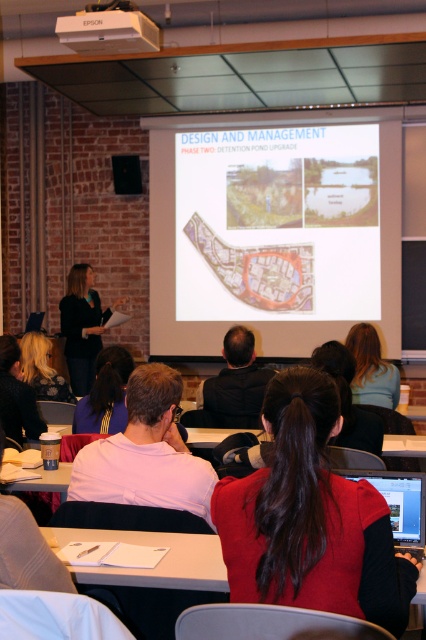
You are sitting in the classroom and want to pass a note to the person with blonde hair at upper center and the person with blonde hair at lower left. Which person is closer to you?

The blonde hair at upper center is closer to the viewer than the blonde hair at lower left.

You are an attendee at this presentation and you want to describe the clothing of the presenter. Which clothing item is higher on their body between the red velvet sweater at center and the pink fabric shirt at center?

The red velvet sweater at center is above the pink fabric shirt at center, so the red velvet sweater at center is higher on their body.

You are an attendee at the presentation and need to place a small notebook on the nearest available surface. The notebook is 10 cm wide. The black fabric at left and the matte black speaker at upper left are both in your immediate vicinity. Which object can you place the notebook on?

The black fabric at left is bigger than the matte black speaker at upper left, so the notebook can be placed on the black fabric at left since it has enough space.